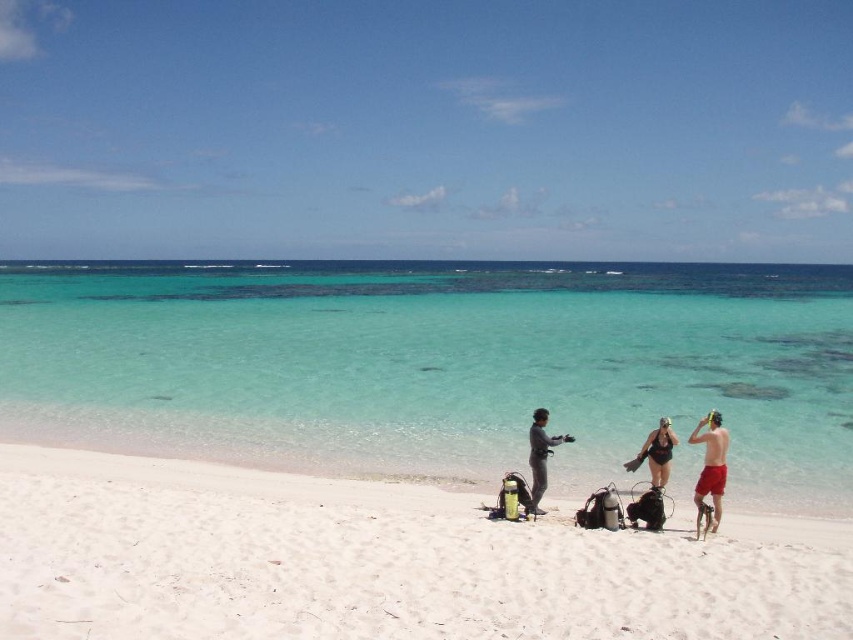
Can you confirm if clear water at center is smaller than black matte swimsuit at center?

No.

You are a GUI agent. You are given a task and a screenshot of the screen. Output one action in this format:
    pyautogui.click(x=<x>, y=<y>)
    Task: Click on the clear water at center
    
    Given the screenshot: What is the action you would take?
    pyautogui.click(x=439, y=365)

The height and width of the screenshot is (640, 853). I want to click on clear water at center, so click(439, 365).

Can you confirm if white sandy beach at center is positioned to the left of red fabric shorts at right?

Yes, white sandy beach at center is to the left of red fabric shorts at right.

Between point (349, 636) and point (711, 499), which one is positioned in front?

Point (349, 636) is in front.

This screenshot has width=853, height=640. In order to click on white sandy beach at center in this screenshot , I will do `click(380, 561)`.

Who is higher up, clear water at center or red fabric shorts at right?

clear water at center

How distant is clear water at center from red fabric shorts at right?

clear water at center is 75.94 meters from red fabric shorts at right.

Image resolution: width=853 pixels, height=640 pixels. In order to click on clear water at center in this screenshot , I will do `click(439, 365)`.